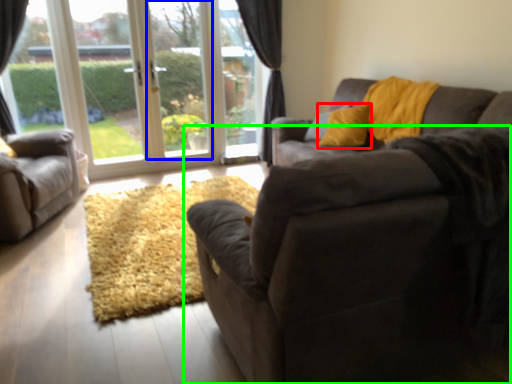
Question: Estimate the real-world distances between objects in this image. Which object is closer to throw pillow (highlighted by a red box), window screen (highlighted by a blue box) or studio couch (highlighted by a green box)?

Choices:
 (A) window screen
 (B) studio couch

Answer: (A)